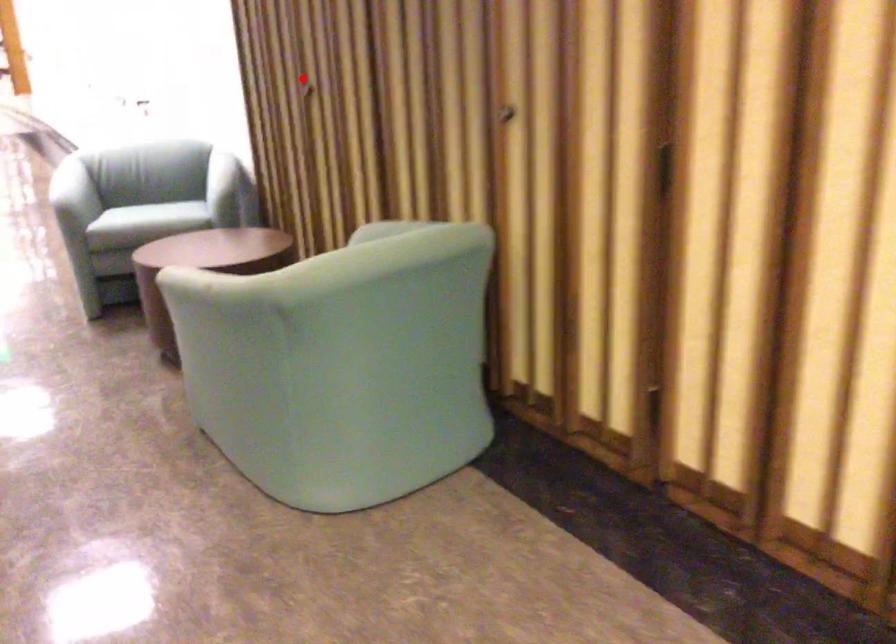
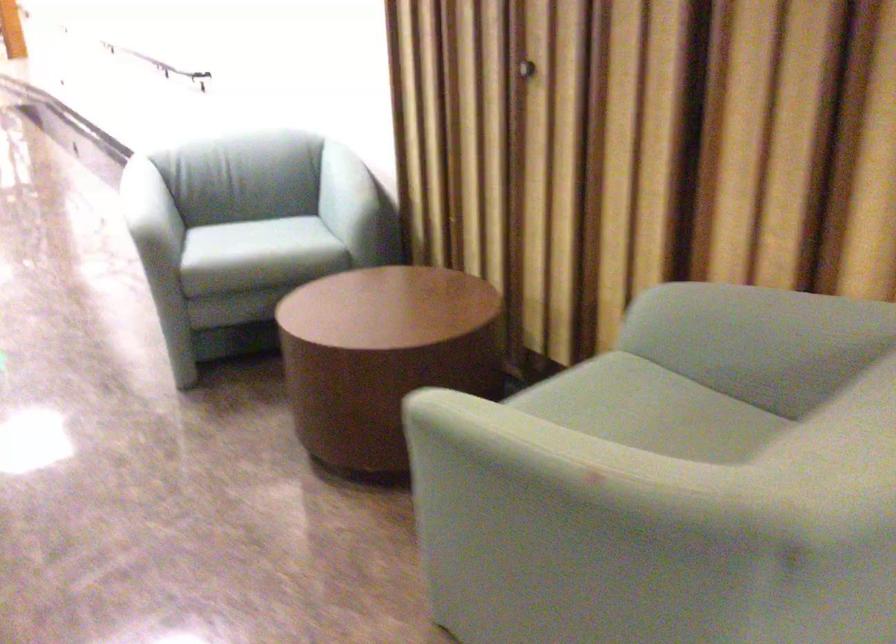
Question: A red point is marked in image1. In image2, is the corresponding 3D point closer to the camera or farther? Reply with the corresponding letter.

Choices:
 (A) The corresponding 3D point is closer.
 (B) The corresponding 3D point is farther.

Answer: (A)